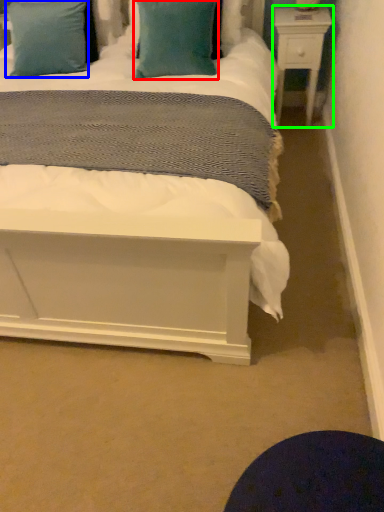
Question: Estimate the real-world distances between objects in this image. Which object is farther from pillow (highlighted by a red box), pillow (highlighted by a blue box) or nightstand (highlighted by a green box)?

Choices:
 (A) pillow
 (B) nightstand

Answer: (B)